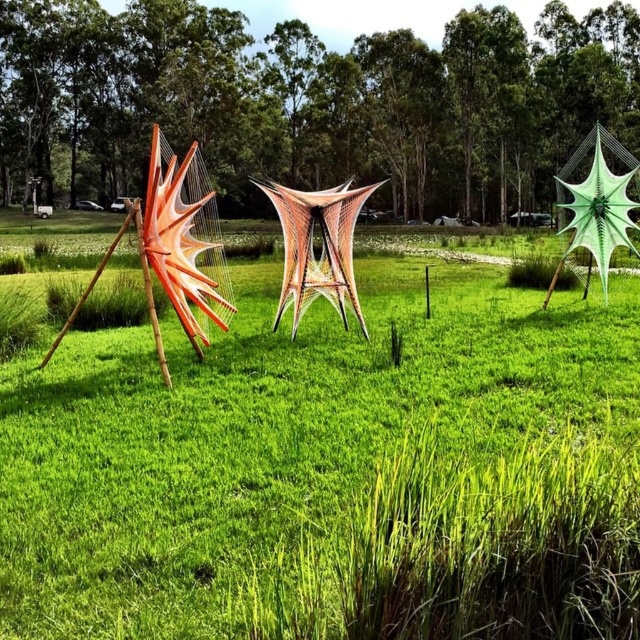
Question: Considering the relative positions of orange woven hammock at left and orange matte kite at left in the image provided, where is orange woven hammock at left located with respect to orange matte kite at left?

Choices:
 (A) below
 (B) above

Answer: (A)

Question: Which point is farther from the camera taking this photo?

Choices:
 (A) (605, 256)
 (B) (195, 273)

Answer: (A)

Question: Which object appears closest to the camera in this image?

Choices:
 (A) green matte sculpture at center
 (B) orange matte kite at left
 (C) orange woven hammock at left
 (D) translucent orange net at center

Answer: (C)

Question: Does translucent orange net at center come in front of green matte kite at right?

Choices:
 (A) no
 (B) yes

Answer: (B)

Question: Estimate the real-world distances between objects in this image. Which object is farther from the green matte kite at right?

Choices:
 (A) translucent orange net at center
 (B) orange matte kite at left
 (C) green matte sculpture at center
 (D) orange woven hammock at left

Answer: (C)

Question: Is the position of orange woven hammock at left more distant than that of translucent orange net at center?

Choices:
 (A) yes
 (B) no

Answer: (B)